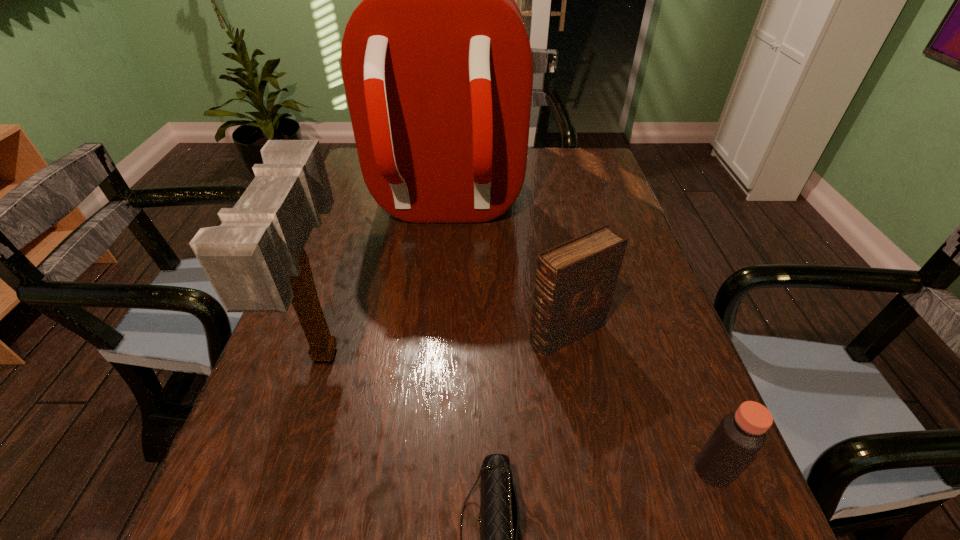
What are the coordinates of `the farthest object` in the screenshot? It's located at (437, 66).

Where is `backpack`? This screenshot has width=960, height=540. backpack is located at coordinates (437, 66).

Identify the location of the second tallest object. The width and height of the screenshot is (960, 540). (255, 260).

The width and height of the screenshot is (960, 540). I want to click on the third shortest object, so click(575, 281).

Identify the location of vinegar. The height and width of the screenshot is (540, 960). (740, 435).

Locate an element on the screen. the second shortest object is located at coordinates (740, 435).

At what (x,y) coordinates should I click in order to perform the action: click on free location located 0.230m on the strap side of the farthest object. Please return your answer as a coordinate pair (x, y). Looking at the image, I should click on (432, 323).

Where is `free space located 0.260m on the right of the mallet`? Image resolution: width=960 pixels, height=540 pixels. free space located 0.260m on the right of the mallet is located at coordinates (475, 352).

Where is `vacant position located 0.120m on the left of the third tallest object`? The width and height of the screenshot is (960, 540). vacant position located 0.120m on the left of the third tallest object is located at coordinates (470, 333).

At what (x,y) coordinates should I click in order to perform the action: click on free space located on the back of the vinegar. Please return your answer as a coordinate pair (x, y). Image resolution: width=960 pixels, height=540 pixels. Looking at the image, I should click on (649, 302).